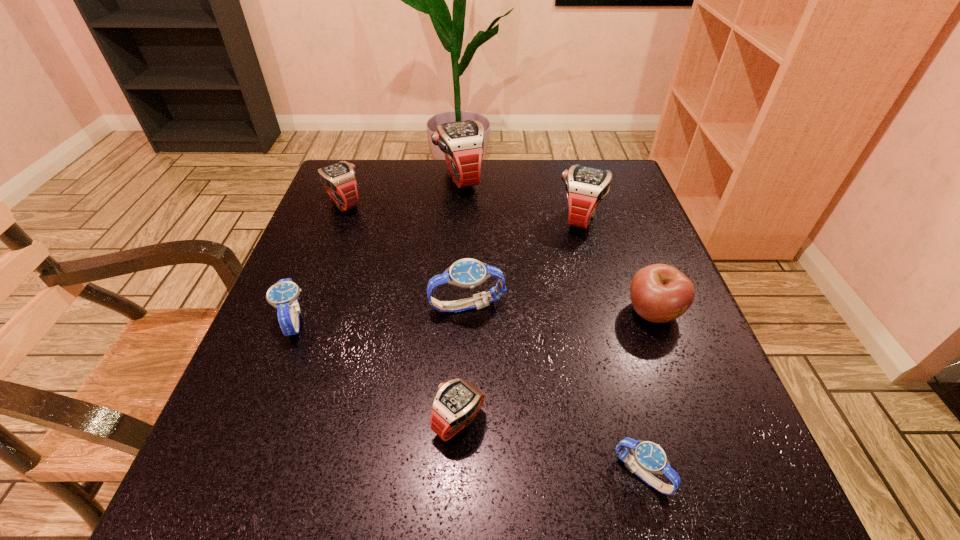
This screenshot has height=540, width=960. Identify the location of object that is at the near edge. (649, 457).

Locate an element on the screen. apple located in the right edge section of the desktop is located at coordinates tap(660, 293).

This screenshot has width=960, height=540. I want to click on object present at the far left corner, so click(339, 179).

This screenshot has height=540, width=960. I want to click on object at the far right corner, so click(586, 187).

Find the location of a particular element. The width and height of the screenshot is (960, 540). object that is at the near right corner is located at coordinates (649, 457).

This screenshot has height=540, width=960. What are the coordinates of `free space at the far edge of the desktop` in the screenshot? It's located at (527, 194).

Image resolution: width=960 pixels, height=540 pixels. I want to click on vacant space at the near edge of the desktop, so tap(325, 471).

Find the location of a particular element. Image resolution: width=960 pixels, height=540 pixels. vacant space at the left edge is located at coordinates (294, 459).

In the image, there is a desktop. Identify the location of vacant space at the right edge. (692, 458).

In the image, there is a desktop. Find the location of `vacant space at the far left corner`. vacant space at the far left corner is located at coordinates (368, 186).